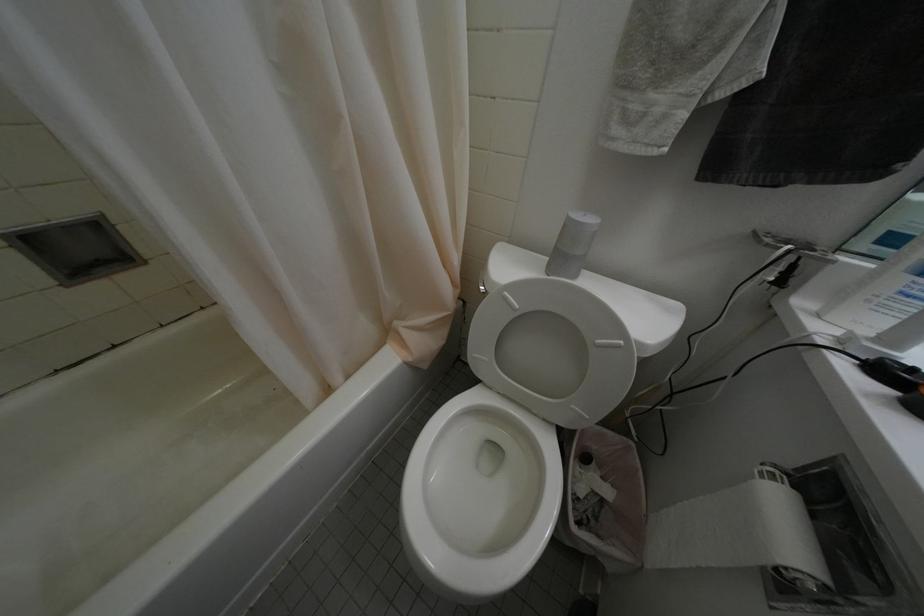
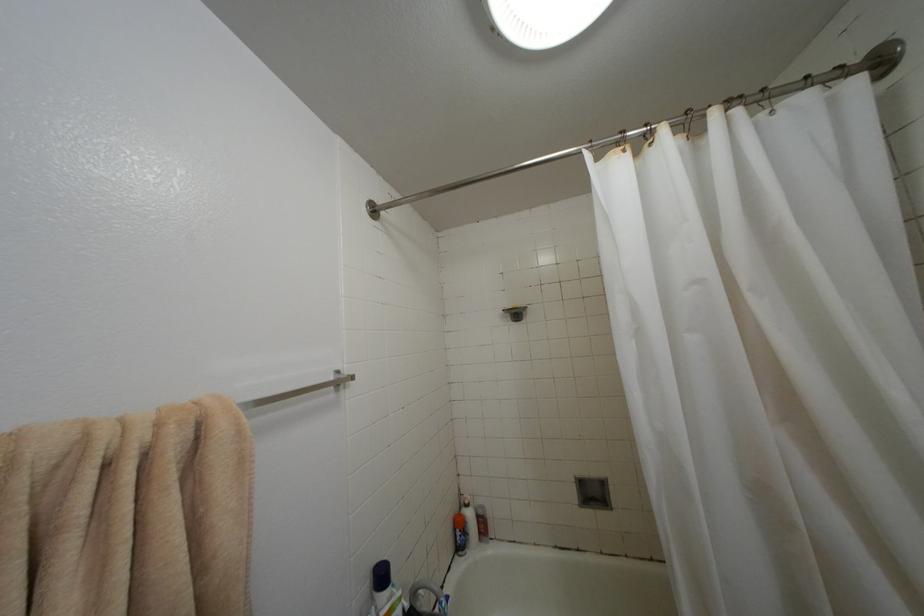
The images are taken continuously from a first-person perspective. In which direction is your viewpoint rotating?

The camera rotated toward left-up.